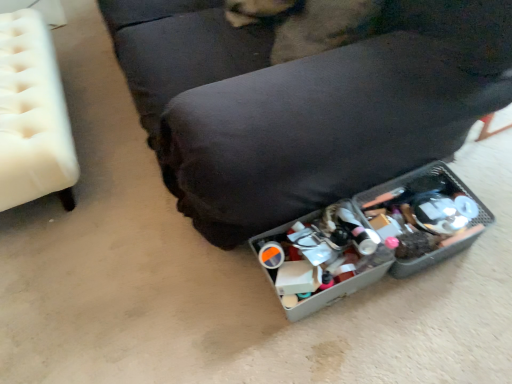
Question: Is metallic gray storage bin at lower right, the 2th furniture from the left, oriented away from white tufted ottoman at left, which appears as the second furniture when viewed from the right?

Choices:
 (A) yes
 (B) no

Answer: (B)

Question: Does metallic gray storage bin at lower right, which appears as the 1th furniture when viewed from the right, come behind white tufted ottoman at left, which appears as the second furniture when viewed from the right?

Choices:
 (A) no
 (B) yes

Answer: (A)

Question: Is metallic gray storage bin at lower right, which appears as the 1th furniture when viewed from the right, taller than white tufted ottoman at left, which appears as the second furniture when viewed from the right?

Choices:
 (A) no
 (B) yes

Answer: (B)

Question: Is metallic gray storage bin at lower right, the 2th furniture from the left, to the right of white tufted ottoman at left, which appears as the second furniture when viewed from the right, from the viewer's perspective?

Choices:
 (A) no
 (B) yes

Answer: (B)

Question: From the image's perspective, is metallic gray storage bin at lower right, the 2th furniture from the left, below white tufted ottoman at left, which appears as the second furniture when viewed from the right?

Choices:
 (A) yes
 (B) no

Answer: (B)

Question: From a real-world perspective, is metallic gray storage bin at lower right, the 2th furniture from the left, positioned under white tufted ottoman at left, which appears as the second furniture when viewed from the right, based on gravity?

Choices:
 (A) no
 (B) yes

Answer: (A)

Question: Could you tell me if white tufted ottoman at left, which appears as the second furniture when viewed from the right, is facing fuzzy brown dog at center?

Choices:
 (A) no
 (B) yes

Answer: (A)

Question: From the image's perspective, is white tufted ottoman at left, which appears as the second furniture when viewed from the right, located beneath fuzzy brown dog at center?

Choices:
 (A) no
 (B) yes

Answer: (B)

Question: From the image's perspective, is white tufted ottoman at left, which is the first furniture from left to right, above fuzzy brown dog at center?

Choices:
 (A) no
 (B) yes

Answer: (A)

Question: Is white tufted ottoman at left, which is the first furniture from left to right, in front of fuzzy brown dog at center?

Choices:
 (A) no
 (B) yes

Answer: (A)

Question: Considering the relative sizes of white tufted ottoman at left, which is the first furniture from left to right, and fuzzy brown dog at center in the image provided, is white tufted ottoman at left, which is the first furniture from left to right, wider than fuzzy brown dog at center?

Choices:
 (A) yes
 (B) no

Answer: (A)

Question: Could you tell me if fuzzy brown dog at center is facing metallic gray storage bin at lower right, which appears as the 1th furniture when viewed from the right?

Choices:
 (A) yes
 (B) no

Answer: (A)